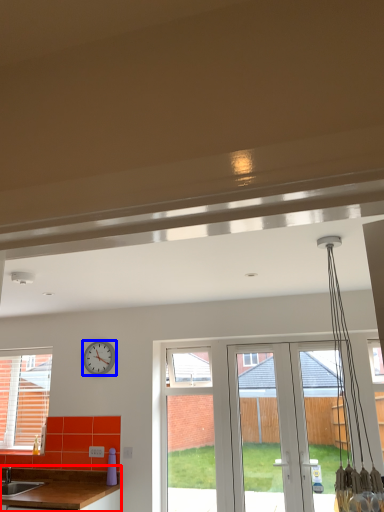
Question: Among these objects, which one is farthest to the camera, countertop (highlighted by a red box) or clock (highlighted by a blue box)?

Choices:
 (A) countertop
 (B) clock

Answer: (B)